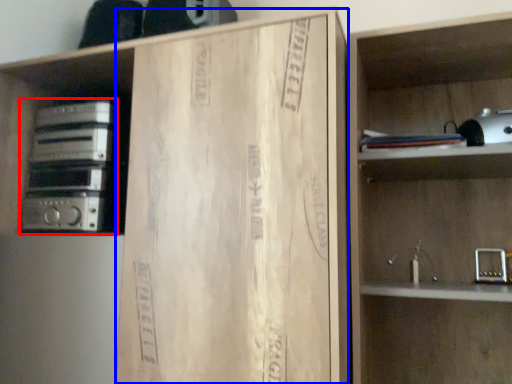
Question: Which object is closer to the camera taking this photo, stereo (highlighted by a red box) or cardboard (highlighted by a blue box)?

Choices:
 (A) stereo
 (B) cardboard

Answer: (B)